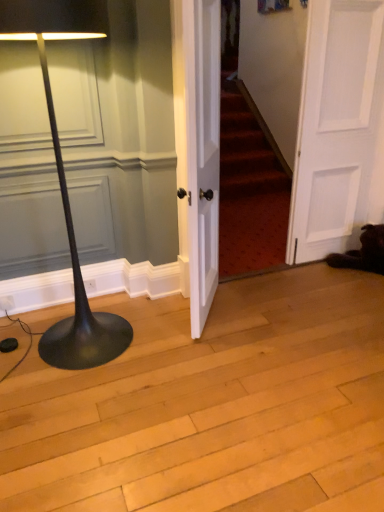
The width and height of the screenshot is (384, 512). In order to click on vacant space to the right of black matte floor lamp at left in this screenshot , I will do `click(165, 347)`.